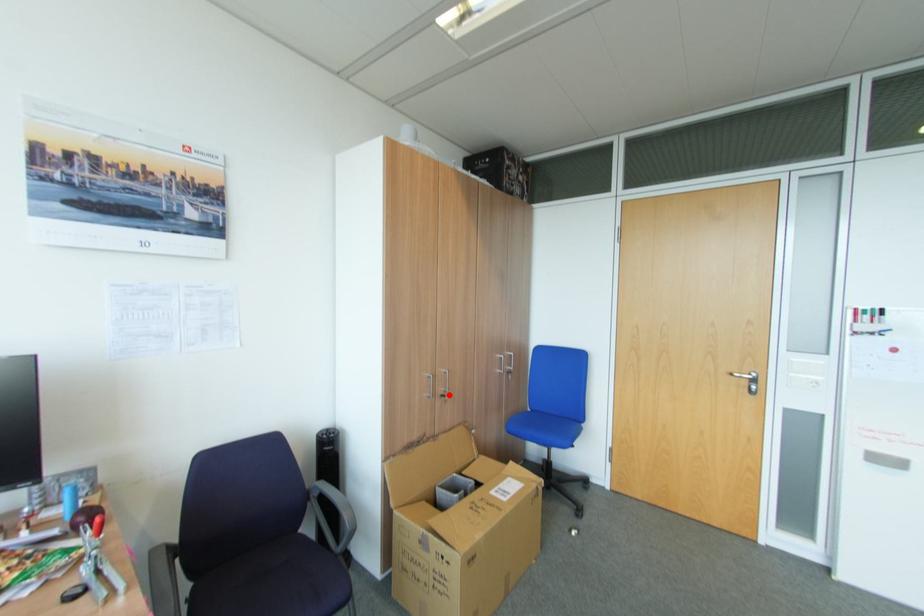
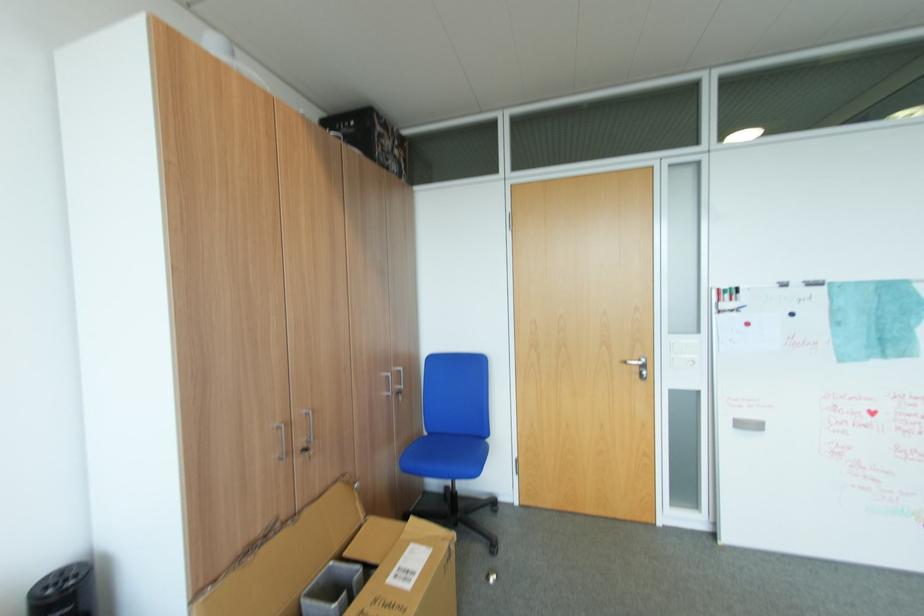
Question: I am providing you with two images of the same scene from different viewpoints. Image1 has a red point marked. In image2, the corresponding 3D location appears at what relative position? Reply with the corresponding letter.

Choices:
 (A) Closer
 (B) Farther

Answer: (A)